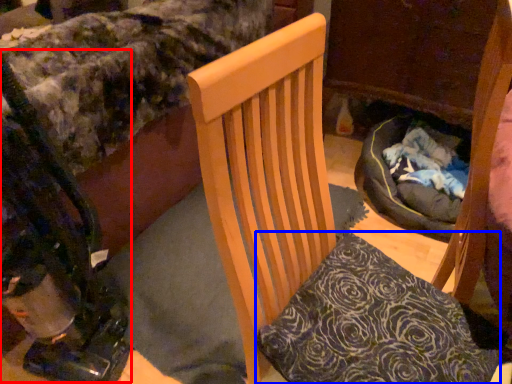
Question: Which object appears farthest to the camera in this image, baby carriage (highlighted by a red box) or pillow (highlighted by a blue box)?

Choices:
 (A) baby carriage
 (B) pillow

Answer: (B)